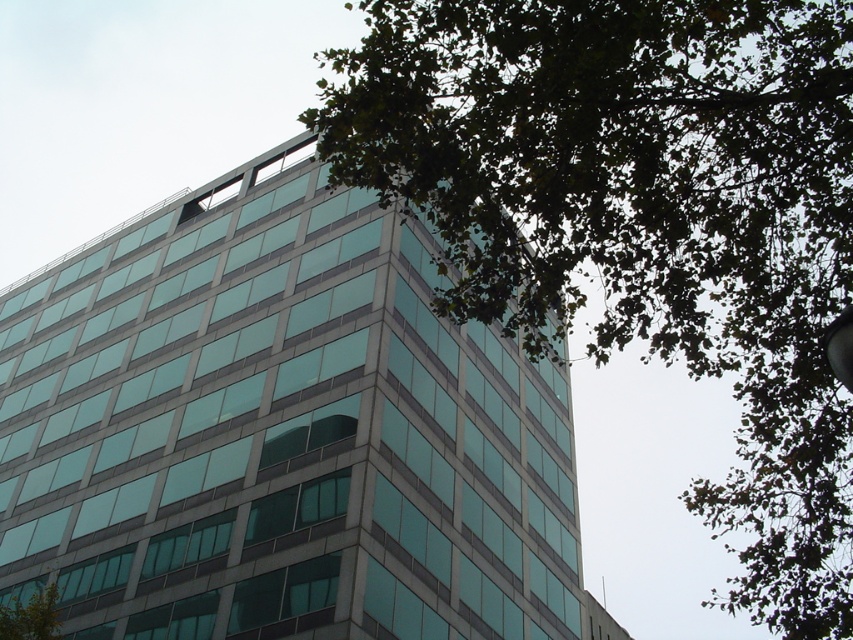
Is point (473, 115) closer to viewer compared to point (16, 604)?

Yes, point (473, 115) is in front of point (16, 604).

From the picture: Who is positioned more to the left, green leafy tree at upper right or green leafy tree at lower left?

green leafy tree at lower left is more to the left.

Does point (766, 419) come in front of point (38, 596)?

Yes.

Where is `green leafy tree at upper right`? The width and height of the screenshot is (853, 640). green leafy tree at upper right is located at coordinates (643, 220).

Is point (805, 264) behind point (842, 332)?

Yes, point (805, 264) is behind point (842, 332).

Who is more forward, (709,116) or (842,346)?

Point (842,346) is more forward.

In order to click on green leafy tree at upper right in this screenshot , I will do `click(643, 220)`.

Does green leafy tree at lower left appear on the left side of metallic silver streetlight at upper right?

Indeed, green leafy tree at lower left is positioned on the left side of metallic silver streetlight at upper right.

Which is more to the right, green leafy tree at lower left or metallic silver streetlight at upper right?

Positioned to the right is metallic silver streetlight at upper right.

Who is more forward, (38,620) or (840,326)?

Positioned in front is point (840,326).

In order to click on green leafy tree at lower left in this screenshot , I will do `click(32, 616)`.